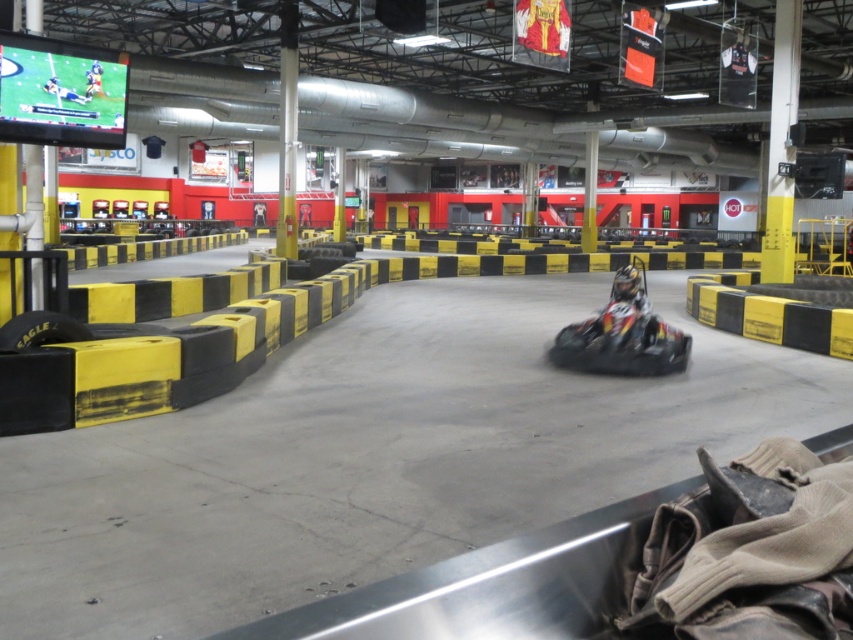
Question: Which point is farther to the camera?

Choices:
 (A) (62, 332)
 (B) (631, 269)

Answer: (B)

Question: Among these points, which one is nearest to the camera?

Choices:
 (A) (614, 278)
 (B) (32, 321)

Answer: (B)

Question: Can you confirm if shiny black helmet at center is positioned to the left of black rubber tire at lower left?

Choices:
 (A) yes
 (B) no

Answer: (B)

Question: Is shiny black helmet at center positioned in front of black rubber tire at lower left?

Choices:
 (A) yes
 (B) no

Answer: (B)

Question: Is shiny black helmet at center closer to the viewer compared to black rubber tire at lower left?

Choices:
 (A) yes
 (B) no

Answer: (B)